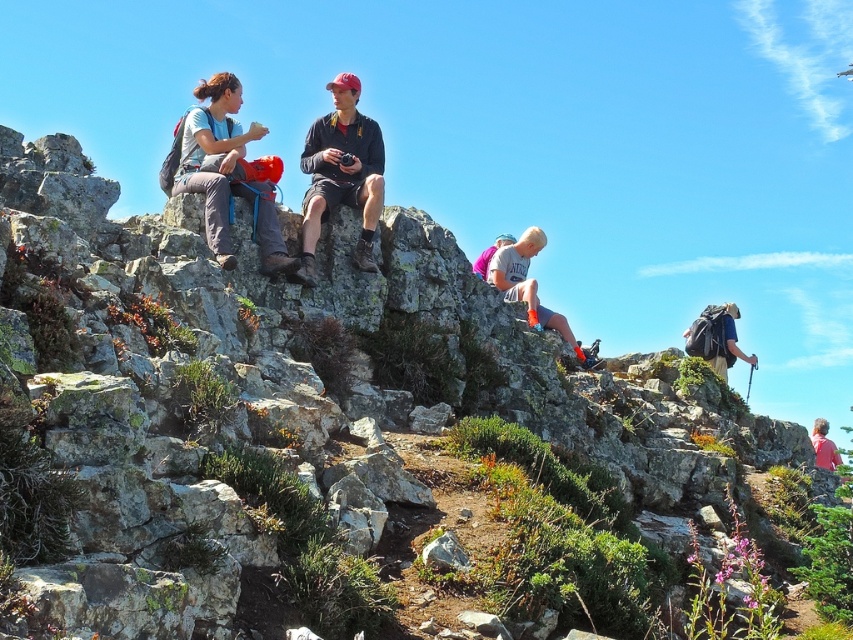
Question: Which of the following is the farthest from the observer?

Choices:
 (A) (524, 291)
 (B) (219, 152)
 (C) (474, 262)
 (D) (729, 364)

Answer: (D)

Question: Which point is farther from the camera taking this photo?

Choices:
 (A) (703, 326)
 (B) (820, 445)
 (C) (225, 218)

Answer: (B)

Question: Does matte gray backpack at upper left come in front of pink fabric shirt at lower right?

Choices:
 (A) yes
 (B) no

Answer: (A)

Question: Considering the relative positions of blonde hair at center and pink fabric shirt at lower right in the image provided, where is blonde hair at center located with respect to pink fabric shirt at lower right?

Choices:
 (A) above
 (B) below

Answer: (A)

Question: Can you confirm if blonde hair at center is positioned below pink fabric shirt at lower right?

Choices:
 (A) no
 (B) yes

Answer: (A)

Question: Which object is farther from the camera taking this photo?

Choices:
 (A) matte black backpack at right
 (B) pink fabric shirt at lower right
 (C) blonde hair at center
 (D) matte gray backpack at upper left

Answer: (A)